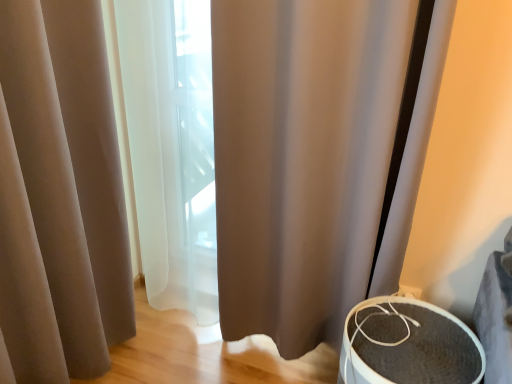
Question: Is textured gray speaker at lower right a part of brown fabric shower curtain at center?

Choices:
 (A) no
 (B) yes

Answer: (A)

Question: Can you confirm if brown fabric shower curtain at center is smaller than textured gray speaker at lower right?

Choices:
 (A) yes
 (B) no

Answer: (B)

Question: Is brown fabric shower curtain at center located outside textured gray speaker at lower right?

Choices:
 (A) no
 (B) yes

Answer: (B)

Question: From a real-world perspective, is brown fabric shower curtain at center on top of textured gray speaker at lower right?

Choices:
 (A) no
 (B) yes

Answer: (B)

Question: From a real-world perspective, is brown fabric shower curtain at center physically below textured gray speaker at lower right?

Choices:
 (A) yes
 (B) no

Answer: (B)

Question: Can you confirm if brown fabric shower curtain at center is positioned to the left of textured gray speaker at lower right?

Choices:
 (A) no
 (B) yes

Answer: (B)

Question: Is matte beige curtain at left turned away from textured gray speaker at lower right?

Choices:
 (A) yes
 (B) no

Answer: (B)

Question: Would you say matte beige curtain at left is a long distance from textured gray speaker at lower right?

Choices:
 (A) yes
 (B) no

Answer: (A)

Question: Considering the relative sizes of matte beige curtain at left and textured gray speaker at lower right in the image provided, is matte beige curtain at left shorter than textured gray speaker at lower right?

Choices:
 (A) no
 (B) yes

Answer: (A)

Question: From the image's perspective, would you say matte beige curtain at left is positioned over textured gray speaker at lower right?

Choices:
 (A) yes
 (B) no

Answer: (A)

Question: Is matte beige curtain at left to the right of textured gray speaker at lower right from the viewer's perspective?

Choices:
 (A) no
 (B) yes

Answer: (A)

Question: From a real-world perspective, is matte beige curtain at left physically below textured gray speaker at lower right?

Choices:
 (A) no
 (B) yes

Answer: (A)

Question: Considering the relative positions of textured gray speaker at lower right and matte beige curtain at left in the image provided, is textured gray speaker at lower right behind matte beige curtain at left?

Choices:
 (A) yes
 (B) no

Answer: (A)